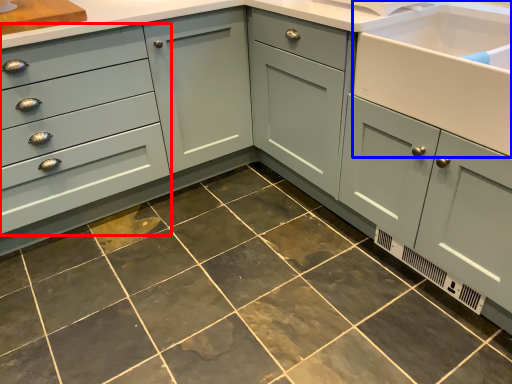
Question: Which object appears farthest to the camera in this image, drawer (highlighted by a red box) or sink (highlighted by a blue box)?

Choices:
 (A) drawer
 (B) sink

Answer: (A)